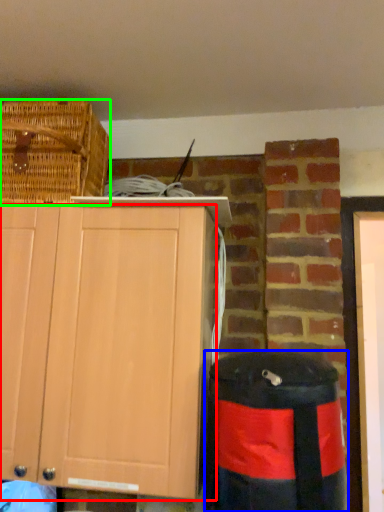
Question: Which object is the farthest from cabinetry (highlighted by a red box)? Choose among these: trash bin/can (highlighted by a blue box) or picnic basket (highlighted by a green box).

Choices:
 (A) trash bin/can
 (B) picnic basket

Answer: (B)